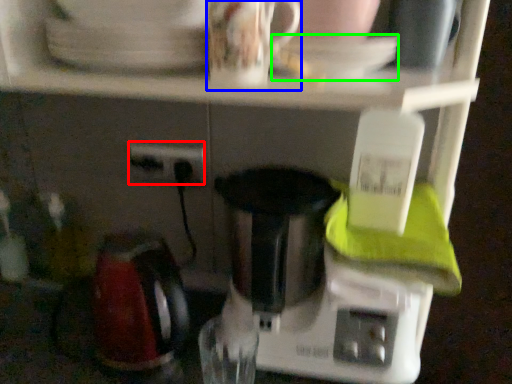
Question: Considering the real-world distances, which object is closest to power plugs and sockets (highlighted by a red box)? coffee cup (highlighted by a blue box) or saucer (highlighted by a green box).

Choices:
 (A) coffee cup
 (B) saucer

Answer: (A)